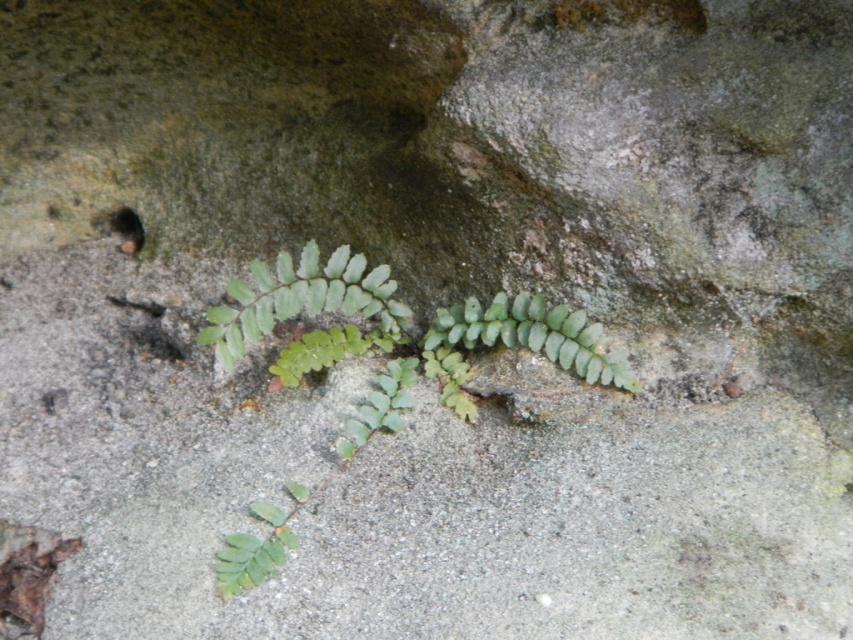
Between point (393, 404) and point (276, 289), which one is positioned behind?

The point (276, 289) is more distant.

Does green leafy plant at center have a lesser height compared to green leafy fern at center?

In fact, green leafy plant at center may be taller than green leafy fern at center.

Find the location of a particular element. This screenshot has height=640, width=853. green leafy plant at center is located at coordinates (310, 310).